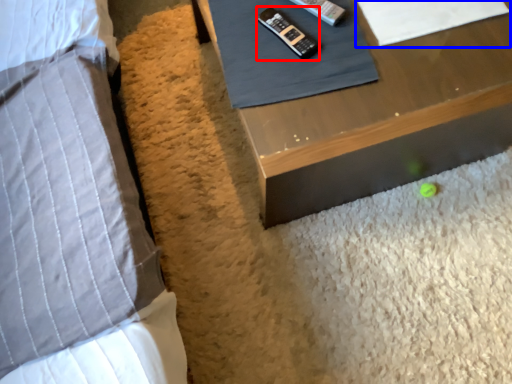
Question: Among these objects, which one is nearest to the camera, control (highlighted by a red box) or sheet (highlighted by a blue box)?

Choices:
 (A) control
 (B) sheet

Answer: (A)